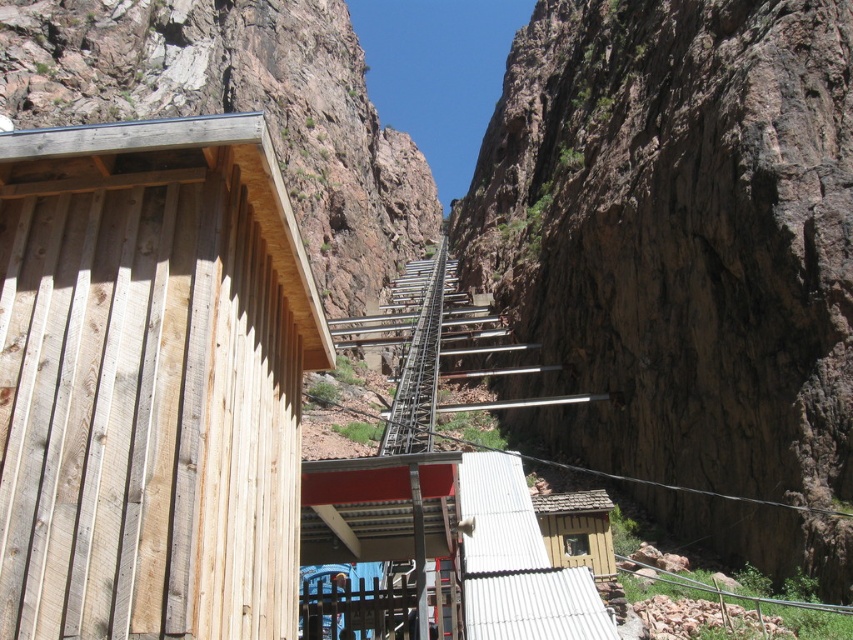
Looking at this image, does white corrugated metal hut at center appear under metallic gray train track at center?

Yes, white corrugated metal hut at center is below metallic gray train track at center.

Locate an element on the screen. white corrugated metal hut at center is located at coordinates (442, 550).

Describe the element at coordinates (241, 109) in the screenshot. I see `brown wood mountain at upper left` at that location.

Is brown wood mountain at upper left in front of white corrugated metal hut at center?

Yes, it is.

This screenshot has width=853, height=640. What do you see at coordinates (241, 109) in the screenshot? I see `brown wood mountain at upper left` at bounding box center [241, 109].

I want to click on brown wood mountain at upper left, so click(x=241, y=109).

Who is lower down, brown rough rock at center or wooden cabin at center-right?

wooden cabin at center-right is lower down.

Locate an element on the screen. Image resolution: width=853 pixels, height=640 pixels. brown rough rock at center is located at coordinates (677, 237).